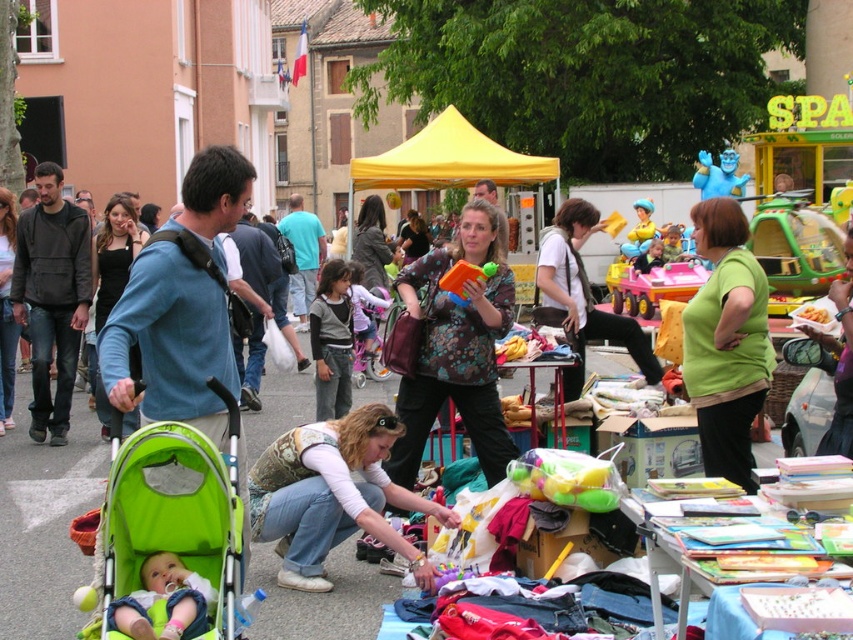
Question: Is denim pants at lower center further to camera compared to soft green fabric stroller at lower left?

Choices:
 (A) no
 (B) yes

Answer: (B)

Question: Estimate the real-world distances between objects in this image. Which object is farther from the soft green fabric stroller at lower left?

Choices:
 (A) denim pants at lower center
 (B) black fabric purse at left

Answer: (B)

Question: Is floral print blouse at center bigger than blue plush toy at upper center?

Choices:
 (A) yes
 (B) no

Answer: (A)

Question: Which of these objects is positioned closest to the floral-patterned fabric purse at center?

Choices:
 (A) soft green fabric stroller at lower left
 (B) floral-patterned fabric at center

Answer: (B)

Question: Which point is closer to the camera taking this photo?

Choices:
 (A) coord(543,234)
 (B) coord(494,266)
 (C) coord(692,182)
 (D) coord(201,637)

Answer: (D)

Question: Can you confirm if denim pants at lower center is smaller than orange matte book at center?

Choices:
 (A) yes
 (B) no

Answer: (B)